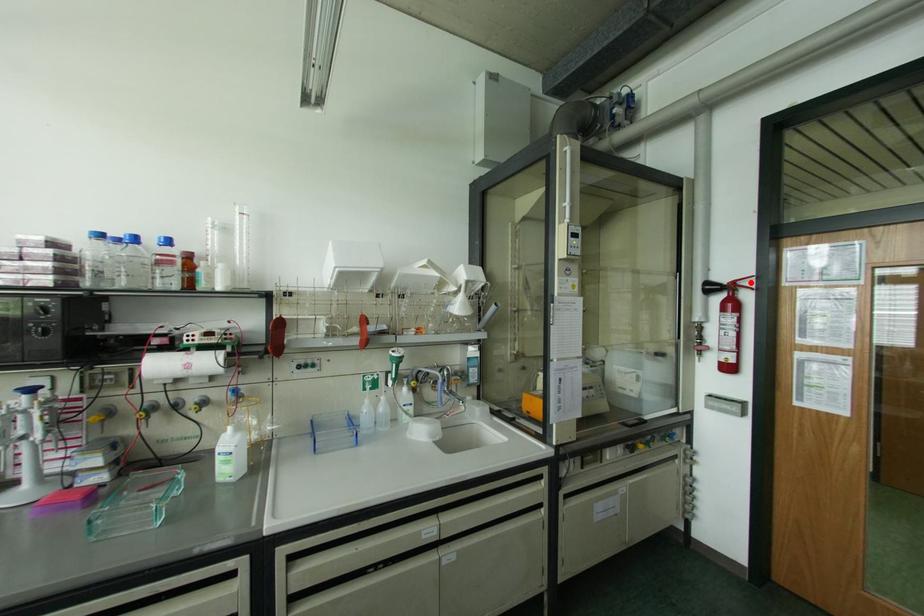
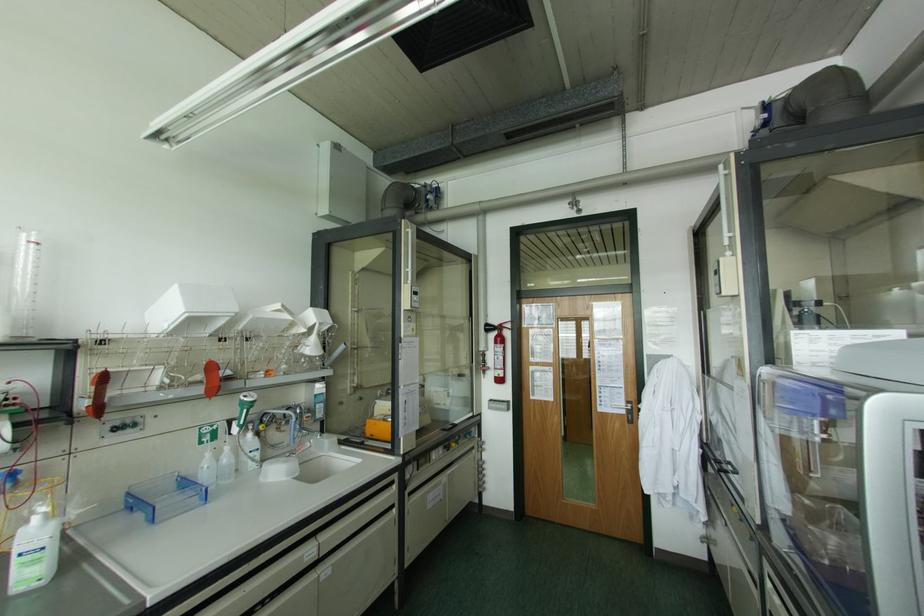
Find the pixel in the second image that matches the highlighted location in the first image.

(507, 325)